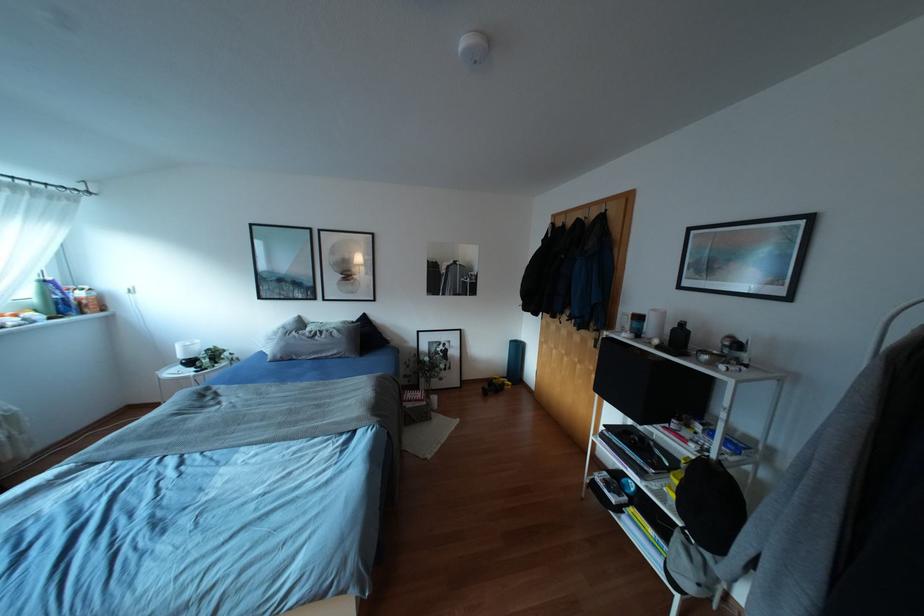
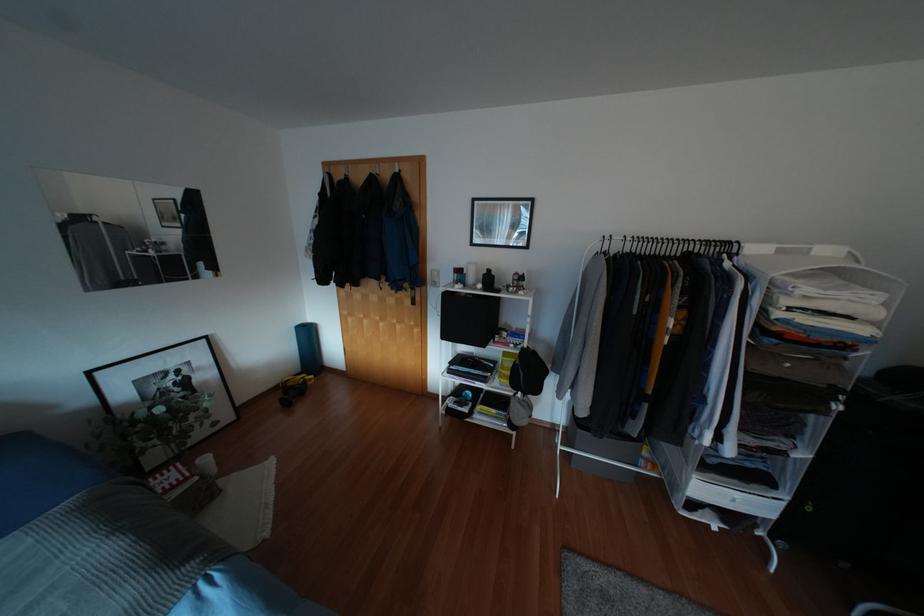
Where in the second image is the point corresponding to the point at 612,214 from the first image?

(406, 176)